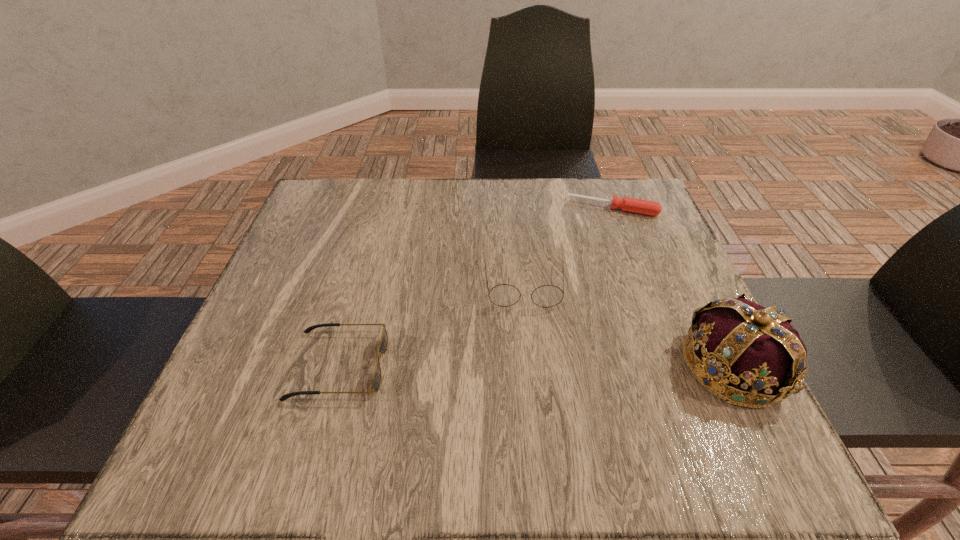
Locate an element on the screen. screwdriver that is at the right edge is located at coordinates (645, 207).

Locate an element on the screen. The width and height of the screenshot is (960, 540). object positioned at the near left corner is located at coordinates (383, 346).

The height and width of the screenshot is (540, 960). What are the coordinates of `object positioned at the far right corner` in the screenshot? It's located at (645, 207).

Where is `object that is at the near right corner`? object that is at the near right corner is located at coordinates (751, 356).

Identify the location of blank space at the far edge. Image resolution: width=960 pixels, height=540 pixels. (379, 217).

This screenshot has width=960, height=540. Find the location of `free space at the near edge`. free space at the near edge is located at coordinates (330, 389).

In order to click on free space at the left edge of the desktop in this screenshot , I will do [x=259, y=335].

Identify the location of vacant space at the right edge of the desktop. This screenshot has width=960, height=540. (627, 319).

At what (x,y) coordinates should I click in order to perform the action: click on blank space at the near left corner of the desktop. Please return your answer as a coordinate pair (x, y). The image size is (960, 540). Looking at the image, I should click on (266, 392).

In the image, there is a desktop. Identify the location of vacant space at the far right corner. (602, 222).